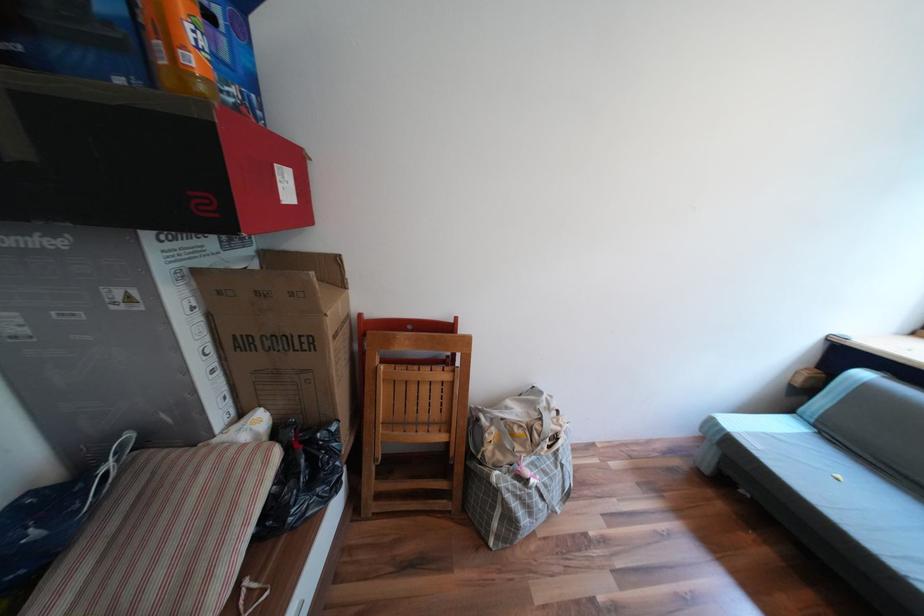
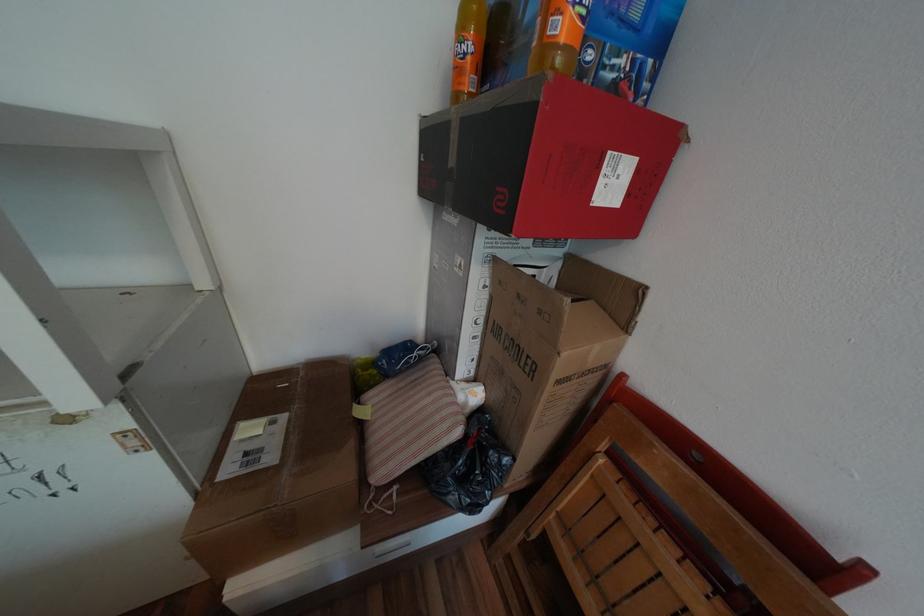
In the second image, find the point that corresponds to point (201, 61) in the first image.

(569, 26)